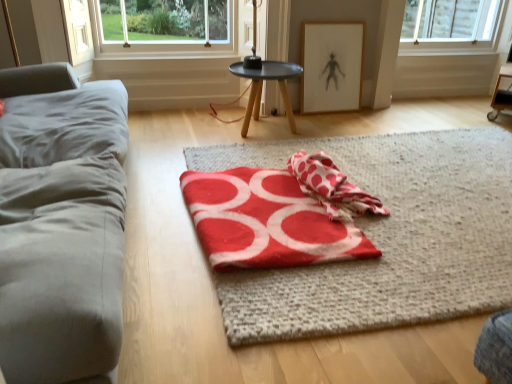
Question: From the image's perspective, would you say red felt beach towel at center, which is the first beach towel in left-to-right order, is positioned over red woolen blanket at center?

Choices:
 (A) no
 (B) yes

Answer: (A)

Question: From a real-world perspective, is red felt beach towel at center, which is the 2th beach towel in right-to-left order, positioned under red woolen blanket at center based on gravity?

Choices:
 (A) no
 (B) yes

Answer: (A)

Question: Can you confirm if red felt beach towel at center, which is the first beach towel in left-to-right order, is smaller than red woolen blanket at center?

Choices:
 (A) yes
 (B) no

Answer: (A)

Question: Is red felt beach towel at center, which is the 2th beach towel in right-to-left order, not close to red woolen blanket at center?

Choices:
 (A) yes
 (B) no

Answer: (B)

Question: Can you confirm if red felt beach towel at center, which is the first beach towel in left-to-right order, is positioned to the left of red woolen blanket at center?

Choices:
 (A) no
 (B) yes

Answer: (B)

Question: Considering the positions of red felt beach towel at center, which is the 2th beach towel in right-to-left order, and wooden framed artwork at upper center in the image, is red felt beach towel at center, which is the 2th beach towel in right-to-left order, taller or shorter than wooden framed artwork at upper center?

Choices:
 (A) tall
 (B) short

Answer: (B)

Question: Considering the positions of red felt beach towel at center, which is the first beach towel in left-to-right order, and wooden framed artwork at upper center in the image, is red felt beach towel at center, which is the first beach towel in left-to-right order, bigger or smaller than wooden framed artwork at upper center?

Choices:
 (A) small
 (B) big

Answer: (B)

Question: From the image's perspective, is red felt beach towel at center, which is the first beach towel in left-to-right order, located above or below wooden framed artwork at upper center?

Choices:
 (A) above
 (B) below

Answer: (B)

Question: Is red felt beach towel at center, which is the first beach towel in left-to-right order, inside or outside of wooden framed artwork at upper center?

Choices:
 (A) inside
 (B) outside

Answer: (B)

Question: Is red polka dot towel at center, the 2th beach towel when ordered from left to right, inside or outside of red woolen blanket at center?

Choices:
 (A) inside
 (B) outside

Answer: (B)

Question: Would you say red polka dot towel at center, which appears as the 1th beach towel when viewed from the right, is to the left or to the right of red woolen blanket at center in the picture?

Choices:
 (A) left
 (B) right

Answer: (A)

Question: In terms of height, does red polka dot towel at center, which appears as the 1th beach towel when viewed from the right, look taller or shorter compared to red woolen blanket at center?

Choices:
 (A) tall
 (B) short

Answer: (A)

Question: From a real-world perspective, is red polka dot towel at center, which appears as the 1th beach towel when viewed from the right, physically located above or below red woolen blanket at center?

Choices:
 (A) above
 (B) below

Answer: (A)

Question: Considering the positions of red felt beach towel at center, which is the first beach towel in left-to-right order, and gray fabric couch at left in the image, is red felt beach towel at center, which is the first beach towel in left-to-right order, taller or shorter than gray fabric couch at left?

Choices:
 (A) short
 (B) tall

Answer: (A)

Question: Looking at the image, does red felt beach towel at center, which is the 2th beach towel in right-to-left order, seem bigger or smaller compared to gray fabric couch at left?

Choices:
 (A) small
 (B) big

Answer: (A)